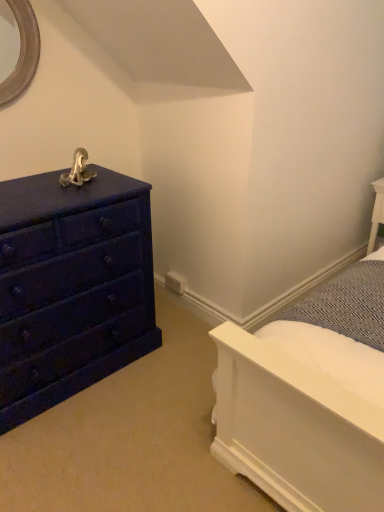
Locate an element on the screen. empty space that is ontop of matte dark blue dresser at left (from a real-world perspective) is located at coordinates (33, 188).